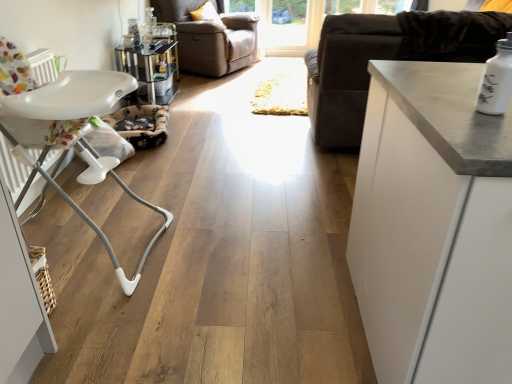
Question: Considering the positions of transparent glass window at upper center, marked as the 1th window screen in a right-to-left arrangement, and metallic glass table at upper center in the image, is transparent glass window at upper center, marked as the 1th window screen in a right-to-left arrangement, bigger or smaller than metallic glass table at upper center?

Choices:
 (A) small
 (B) big

Answer: (B)

Question: Would you say transparent glass window at upper center, marked as the 1th window screen in a right-to-left arrangement, is inside or outside metallic glass table at upper center?

Choices:
 (A) outside
 (B) inside

Answer: (A)

Question: Which object is positioned farthest from the beige leather armchair at upper center?

Choices:
 (A) velvet dark brown couch at right
 (B) transparent glass window at upper center, marked as the 1th window screen in a right-to-left arrangement
 (C) white matte cabinet at upper right
 (D) transparent glass door at upper center, the second window screen from the right
 (E) white plastic highchair at left

Answer: (C)

Question: Which object is the closest to the transparent glass window at upper center, which is the second window screen from left to right?

Choices:
 (A) transparent glass door at upper center, which is the 1th window screen in left-to-right order
 (B) white plastic highchair at left
 (C) white matte cabinet at upper right
 (D) metallic glass table at upper center
 (E) velvet dark brown couch at right

Answer: (A)